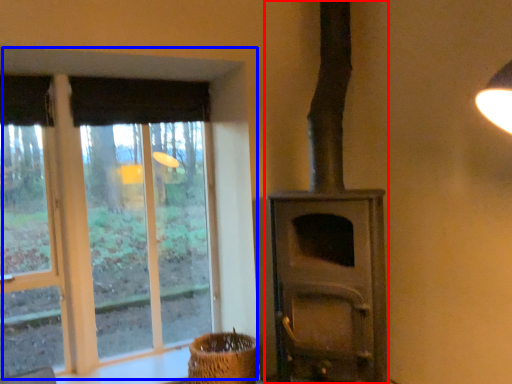
Question: Among these objects, which one is farthest to the camera, wood burning stove (highlighted by a red box) or window (highlighted by a blue box)?

Choices:
 (A) wood burning stove
 (B) window

Answer: (B)